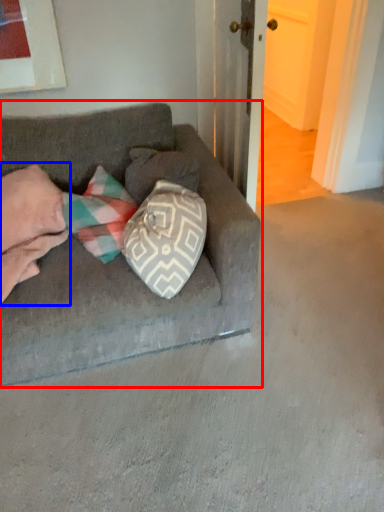
Question: Which object appears farthest to the camera in this image, studio couch (highlighted by a red box) or couple (highlighted by a blue box)?

Choices:
 (A) studio couch
 (B) couple

Answer: (B)